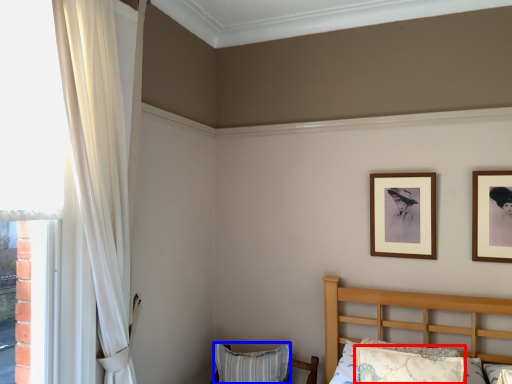
Question: Among these objects, which one is nearest to the camera, pillow (highlighted by a red box) or pillow (highlighted by a blue box)?

Choices:
 (A) pillow
 (B) pillow

Answer: (A)